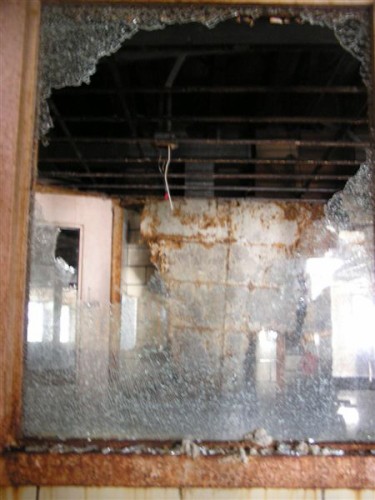
The image size is (375, 500). Find the location of `window in reflection`. window in reflection is located at coordinates (40, 329), (62, 332).